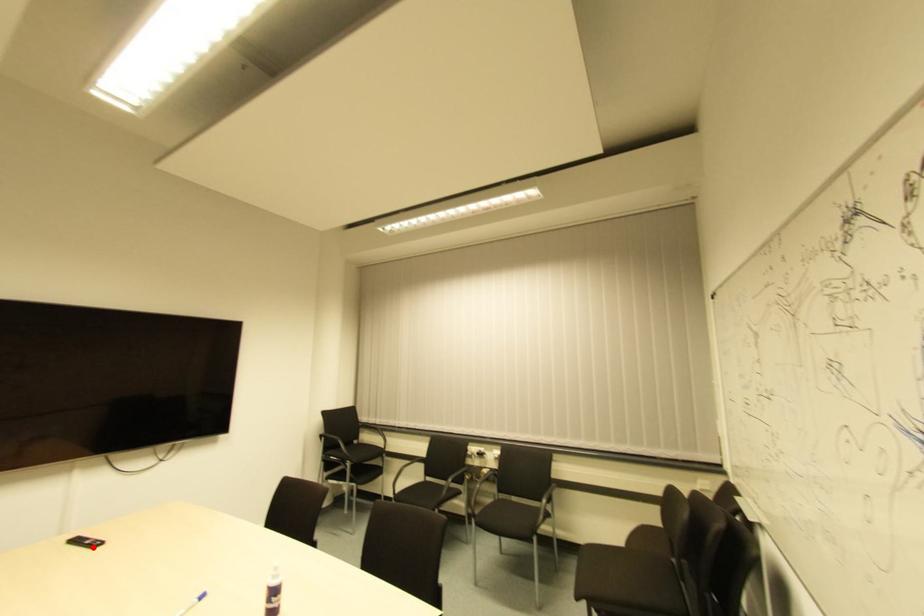
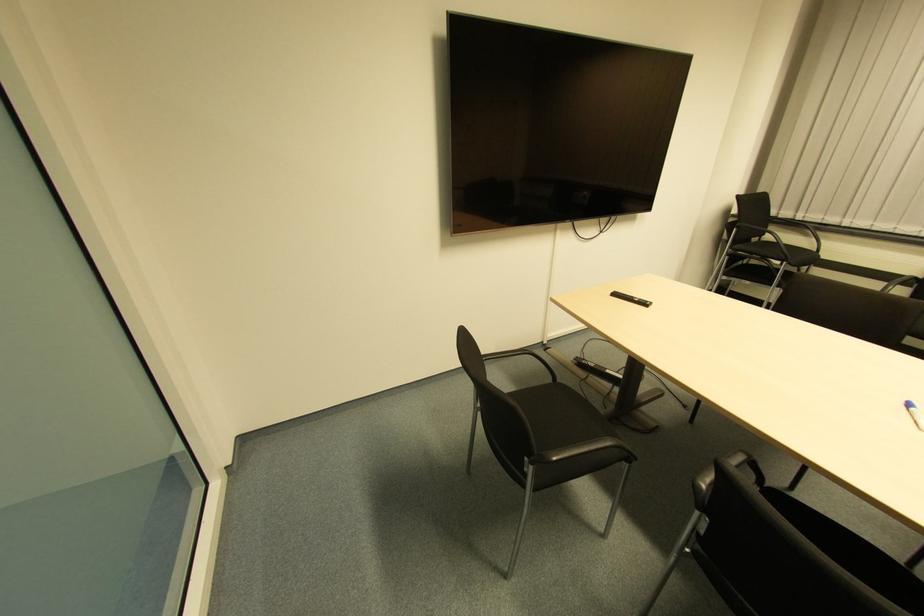
Question: I am providing you with two images of the same scene from different viewpoints. Given a red point in image1, look at the same physical point in image2. Is it:

Choices:
 (A) Closer to the viewpoint
 (B) Farther from the viewpoint

Answer: (B)